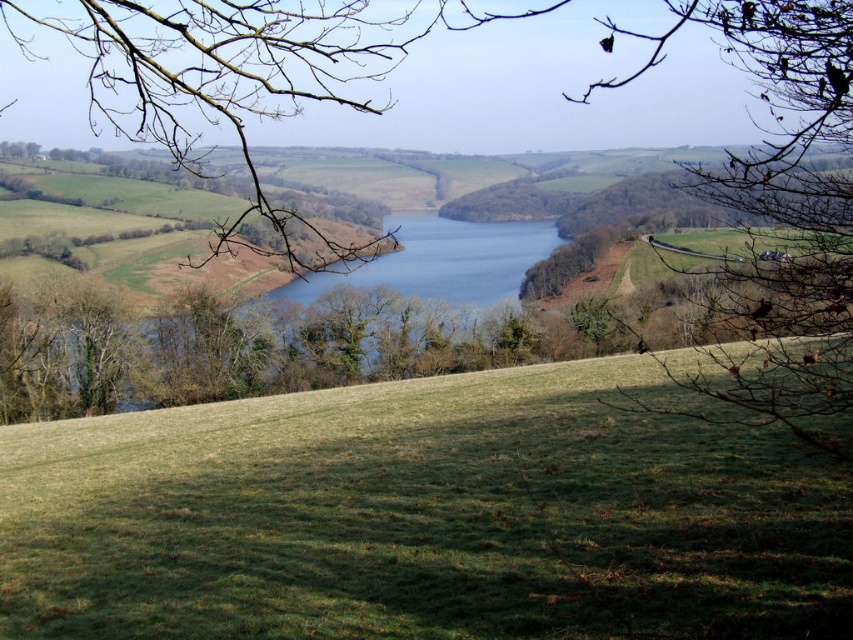
Based on the photo, does green grassy hillside at center lie behind brown leafless branch at upper center?

Yes, it is behind brown leafless branch at upper center.

Image resolution: width=853 pixels, height=640 pixels. Describe the element at coordinates (422, 516) in the screenshot. I see `green grassy hillside at center` at that location.

Locate an element on the screen. The width and height of the screenshot is (853, 640). green grassy hillside at center is located at coordinates (422, 516).